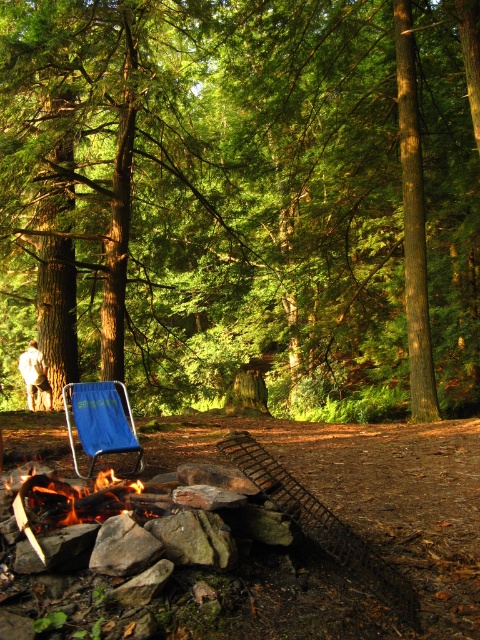
Based on the photo, is brown wood tree at center to the right of blue fabric chair at center from the viewer's perspective?

Indeed, brown wood tree at center is positioned on the right side of blue fabric chair at center.

Does point (358, 358) come closer to viewer compared to point (136, 461)?

No.

At what (x,y) coordinates should I click in order to perform the action: click on brown wood tree at center. Please return your answer as a coordinate pair (x, y). This screenshot has height=640, width=480. Looking at the image, I should click on (243, 196).

The height and width of the screenshot is (640, 480). What do you see at coordinates (70, 499) in the screenshot? I see `flaming wood fire at lower left` at bounding box center [70, 499].

Does flaming wood fire at lower left have a greater width compared to blue fabric chair at center?

Yes, flaming wood fire at lower left is wider than blue fabric chair at center.

Between point (129, 480) and point (132, 428), which one is positioned behind?

The point (132, 428) is behind.

Identify the location of flaming wood fire at lower left. This screenshot has height=640, width=480. (70, 499).

From the picture: Is brown wood tree at center to the left of flaming wood fire at lower left from the viewer's perspective?

Incorrect, brown wood tree at center is not on the left side of flaming wood fire at lower left.

Is brown wood tree at center positioned at the back of flaming wood fire at lower left?

That is True.

Identify the location of brown wood tree at center. (243, 196).

Locate an element on the screen. This screenshot has height=640, width=480. brown wood tree at center is located at coordinates (243, 196).